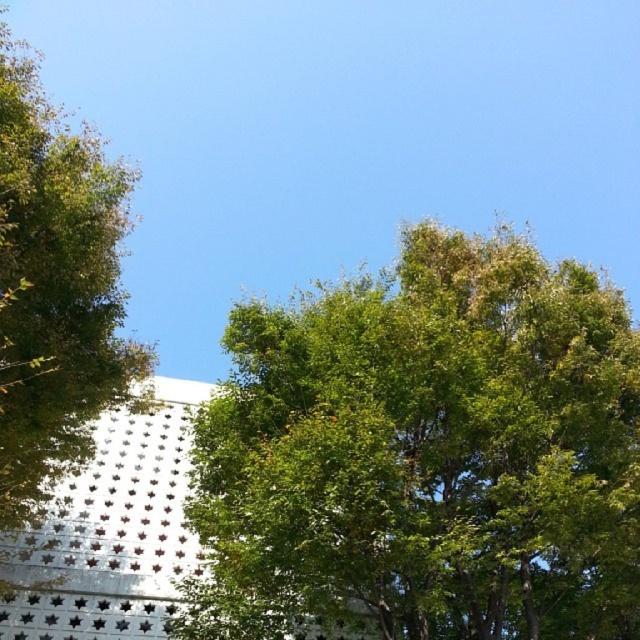
You are standing in the vibrant outdoor scene with lush greenery and a modern building with star cutouts. You notice two points marked in the image. Which point, point (410, 554) or point (92, 364), is closer to you?

Point (410, 554) is closer to the camera than point (92, 364).

You are a bird looking for a nesting spot. You see two green leafy trees in the scene. Which tree, the green leafy tree at center or the green leafy tree at left, is taller and thus might provide a better nesting spot?

The green leafy tree at left is taller than the green leafy tree at center, so it might provide a better nesting spot.